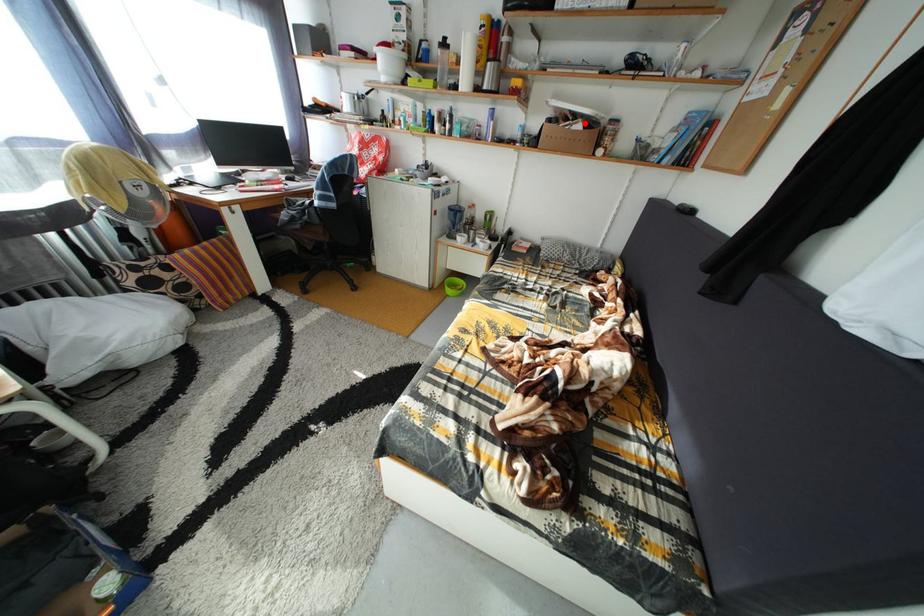
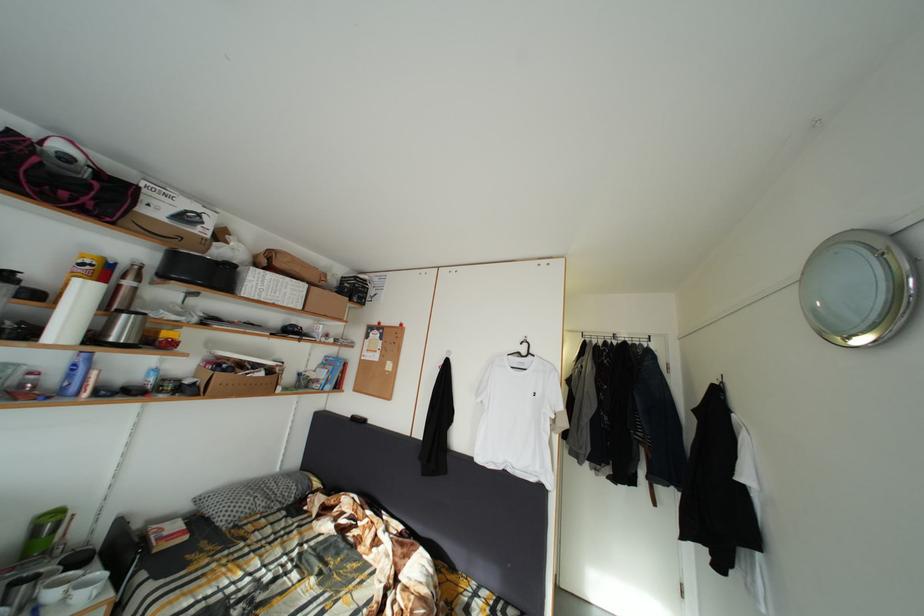
In the second image, find the point that corresponds to the highlighted location in the first image.

(264, 373)